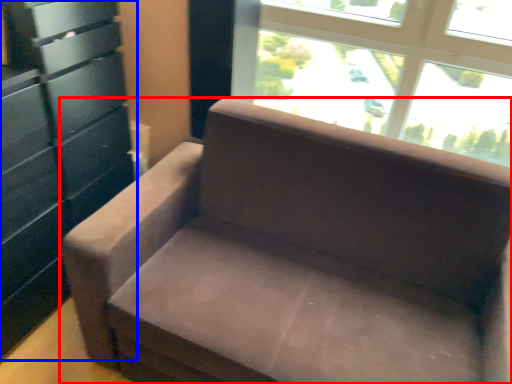
Question: Which of the following is the closest to the observer, studio couch (highlighted by a red box) or dresser (highlighted by a blue box)?

Choices:
 (A) studio couch
 (B) dresser

Answer: (A)